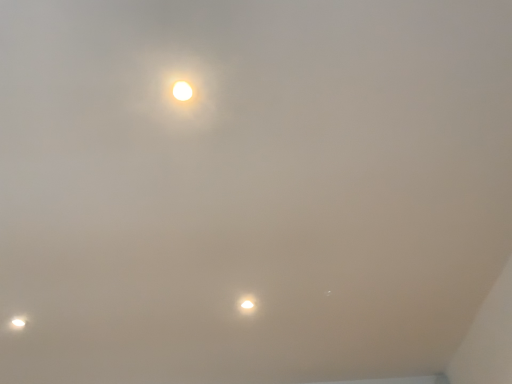
Question: Is matte white lamp at lower left, which is the 1th lamp in bottom-to-top order, wider or thinner than matte white lamp at center, arranged as the second lamp when viewed from the left?

Choices:
 (A) wide
 (B) thin

Answer: (A)

Question: In the image, is matte white lamp at lower left, which appears as the first lamp when viewed from the left, on the left side or the right side of matte white lamp at center, acting as the second lamp starting from the bottom?

Choices:
 (A) left
 (B) right

Answer: (A)

Question: Considering the positions of matte white lamp at lower left, arranged as the second lamp when viewed from the top, and matte white lamp at center, acting as the second lamp starting from the bottom, in the image, is matte white lamp at lower left, arranged as the second lamp when viewed from the top, bigger or smaller than matte white lamp at center, acting as the second lamp starting from the bottom,?

Choices:
 (A) small
 (B) big

Answer: (A)

Question: Based on their sizes in the image, would you say matte white lamp at center, arranged as the second lamp when viewed from the left, is bigger or smaller than matte white lamp at lower left, arranged as the second lamp when viewed from the top?

Choices:
 (A) small
 (B) big

Answer: (B)

Question: Is point (243, 306) positioned closer to the camera than point (19, 319)?

Choices:
 (A) farther
 (B) closer

Answer: (B)

Question: Would you say matte white lamp at center, which is counted as the first lamp, starting from the front, is to the left or to the right of matte white lamp at lower left, arranged as the first lamp when viewed from the back, in the picture?

Choices:
 (A) right
 (B) left

Answer: (A)

Question: Is matte white lamp at center, arranged as the 1th lamp when viewed from the top, taller or shorter than matte white lamp at lower left, the 2th lamp when ordered from right to left?

Choices:
 (A) short
 (B) tall

Answer: (B)